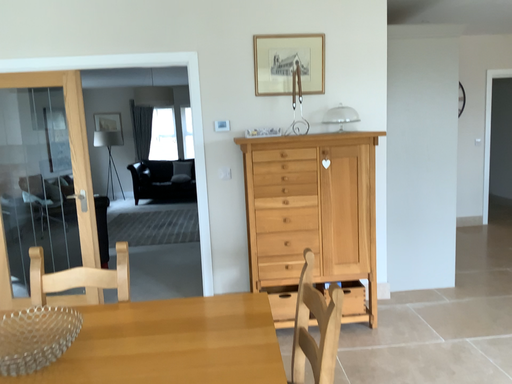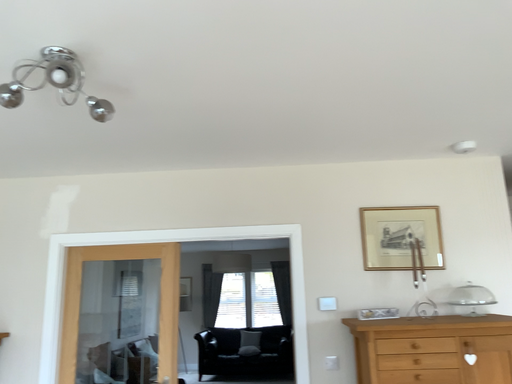
Question: Which way did the camera rotate in the video?

Choices:
 (A) rotated downward
 (B) rotated upward

Answer: (B)